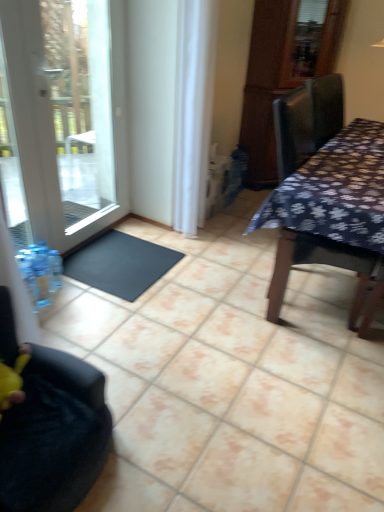
I want to click on free space in front of white glass door at left, so click(x=104, y=314).